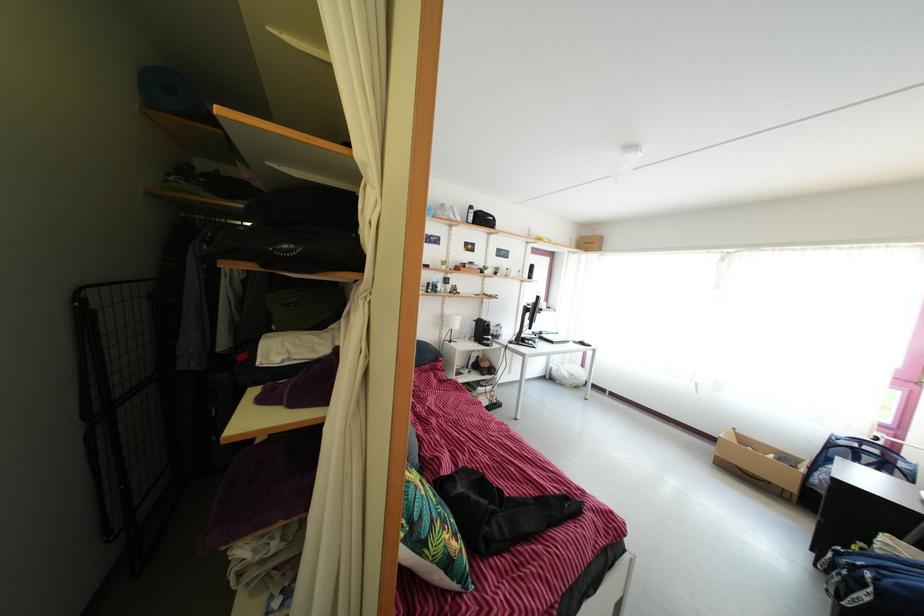
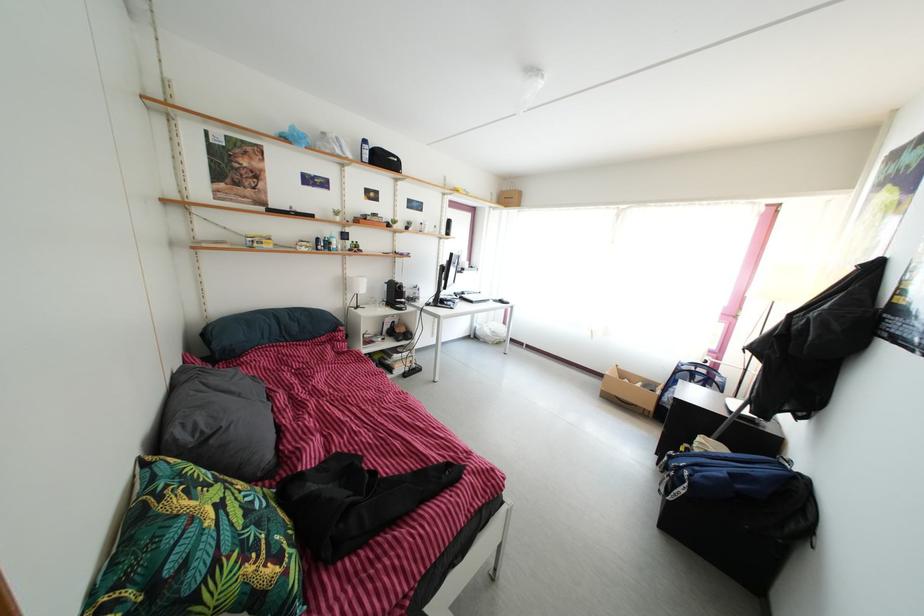
Question: The first image is from the beginning of the video and the second image is from the end. How did the camera likely rotate when shooting the video?

Choices:
 (A) Left
 (B) Right
 (C) Up
 (D) Down

Answer: (B)